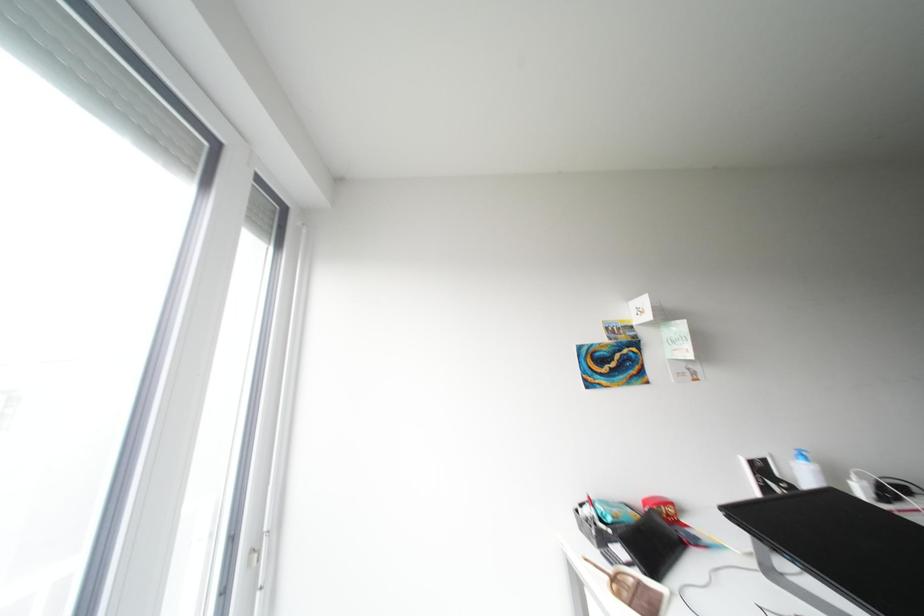
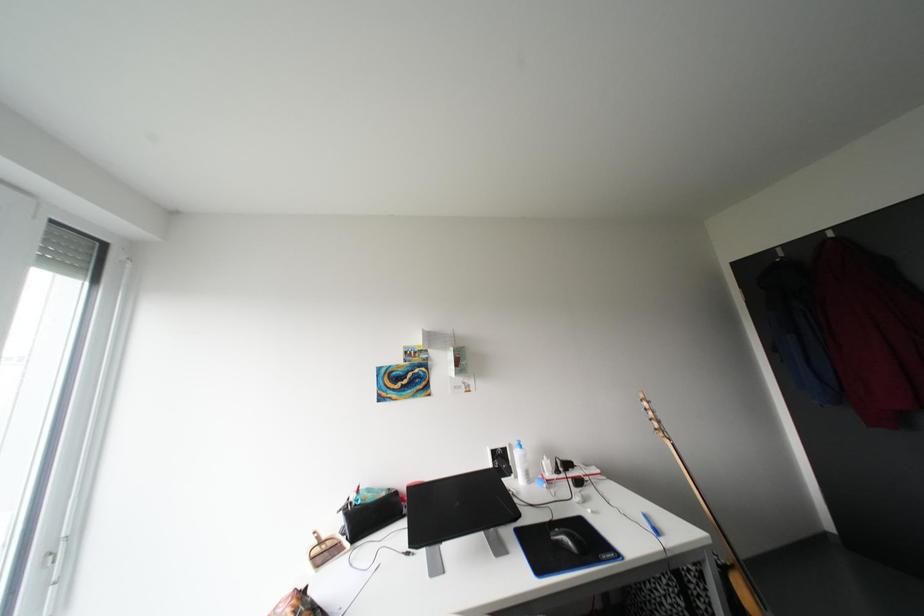
Which direction would the cameraman need to move to produce the second image?

The cameraman walked toward right, backward.